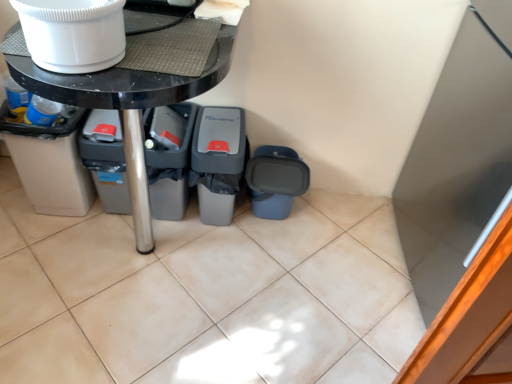
Locate an element on the screen. vacant region in front of blue matte recycling bin at lower right, which appears as the 1th recycling bin when viewed from the right is located at coordinates (272, 258).